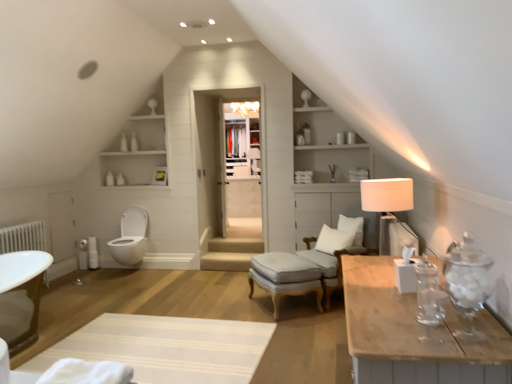
Question: Could white wood drawer at center be considered to be inside white textured rug at lower center?

Choices:
 (A) yes
 (B) no

Answer: (B)

Question: Are white textured rug at lower center and white wood drawer at center located far from each other?

Choices:
 (A) no
 (B) yes

Answer: (B)

Question: Considering the relative sizes of white textured rug at lower center and white wood drawer at center in the image provided, is white textured rug at lower center smaller than white wood drawer at center?

Choices:
 (A) no
 (B) yes

Answer: (B)

Question: Is white textured rug at lower center shorter than white wood drawer at center?

Choices:
 (A) no
 (B) yes

Answer: (B)

Question: Is white textured rug at lower center facing away from white wood drawer at center?

Choices:
 (A) no
 (B) yes

Answer: (A)

Question: From a real-world perspective, is white textured rug at lower center located beneath white wood drawer at center?

Choices:
 (A) no
 (B) yes

Answer: (B)

Question: Does white textured rug at lower center appear on the right side of light gray fabric stool at center?

Choices:
 (A) no
 (B) yes

Answer: (A)

Question: From a real-world perspective, is white textured rug at lower center physically below light gray fabric stool at center?

Choices:
 (A) yes
 (B) no

Answer: (A)

Question: Is white textured rug at lower center next to light gray fabric stool at center?

Choices:
 (A) no
 (B) yes

Answer: (A)

Question: Does white textured rug at lower center lie in front of light gray fabric stool at center?

Choices:
 (A) yes
 (B) no

Answer: (A)

Question: Is white textured rug at lower center positioned behind light gray fabric stool at center?

Choices:
 (A) no
 (B) yes

Answer: (A)

Question: Can you confirm if white textured rug at lower center is taller than light gray fabric stool at center?

Choices:
 (A) no
 (B) yes

Answer: (A)

Question: Does light gray fabric stool at center turn towards white textured rug at lower center?

Choices:
 (A) no
 (B) yes

Answer: (B)